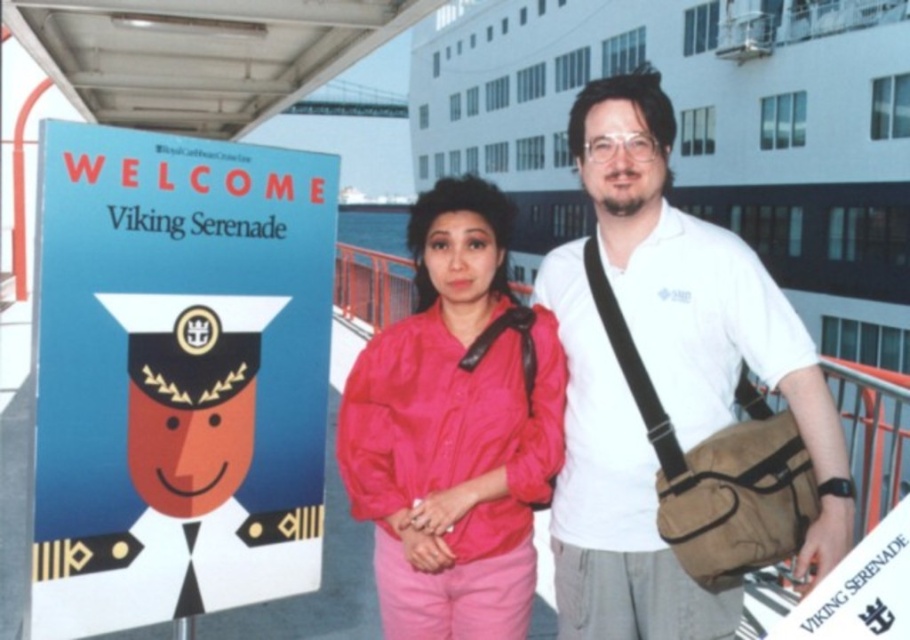
Question: In this image, where is blue paper sign at upper left located relative to matte pink jacket at center?

Choices:
 (A) right
 (B) left

Answer: (B)

Question: Which point is closer to the camera?

Choices:
 (A) (644, 113)
 (B) (455, 292)
 (C) (320, 556)

Answer: (B)

Question: Does blue paper sign at upper left appear on the right side of white cotton shirt at center?

Choices:
 (A) yes
 (B) no

Answer: (B)

Question: Estimate the real-world distances between objects in this image. Which object is closer to the white cotton shirt at center?

Choices:
 (A) blue paper sign at upper left
 (B) matte pink jacket at center

Answer: (B)

Question: Is blue paper sign at upper left further to the viewer compared to white cotton shirt at center?

Choices:
 (A) no
 (B) yes

Answer: (A)

Question: Estimate the real-world distances between objects in this image. Which object is farther from the white cotton shirt at center?

Choices:
 (A) blue paper sign at upper left
 (B) matte pink jacket at center

Answer: (A)